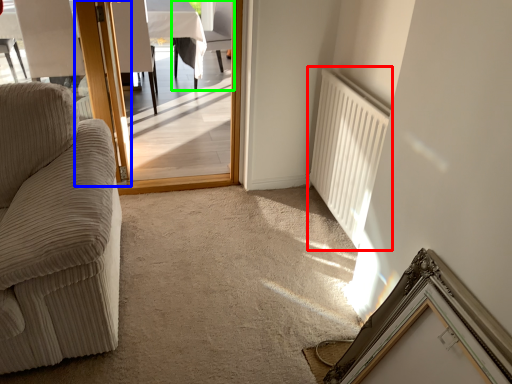
Question: Estimate the real-world distances between objects in this image. Which object is farther from radiator (highlighted by a red box), door (highlighted by a blue box) or chair (highlighted by a green box)?

Choices:
 (A) door
 (B) chair

Answer: (B)